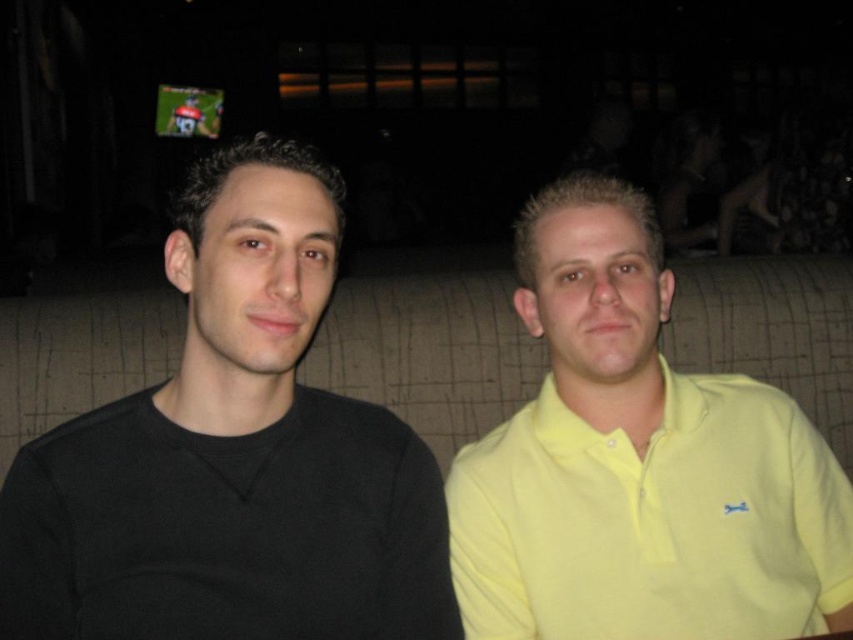
Question: Among these points, which one is nearest to the camera?

Choices:
 (A) (469, 512)
 (B) (155, 458)

Answer: (B)

Question: Does black matte sweater at left appear under yellow matte shirt at right?

Choices:
 (A) yes
 (B) no

Answer: (B)

Question: Is black matte sweater at left positioned at the back of yellow matte shirt at right?

Choices:
 (A) no
 (B) yes

Answer: (A)

Question: Which of the following is the closest to the observer?

Choices:
 (A) (120, 627)
 (B) (538, 390)

Answer: (A)

Question: From the image, what is the correct spatial relationship of black matte sweater at left in relation to yellow matte shirt at right?

Choices:
 (A) right
 (B) left

Answer: (B)

Question: Which point appears closest to the camera in this image?

Choices:
 (A) (212, 449)
 (B) (682, 461)

Answer: (A)